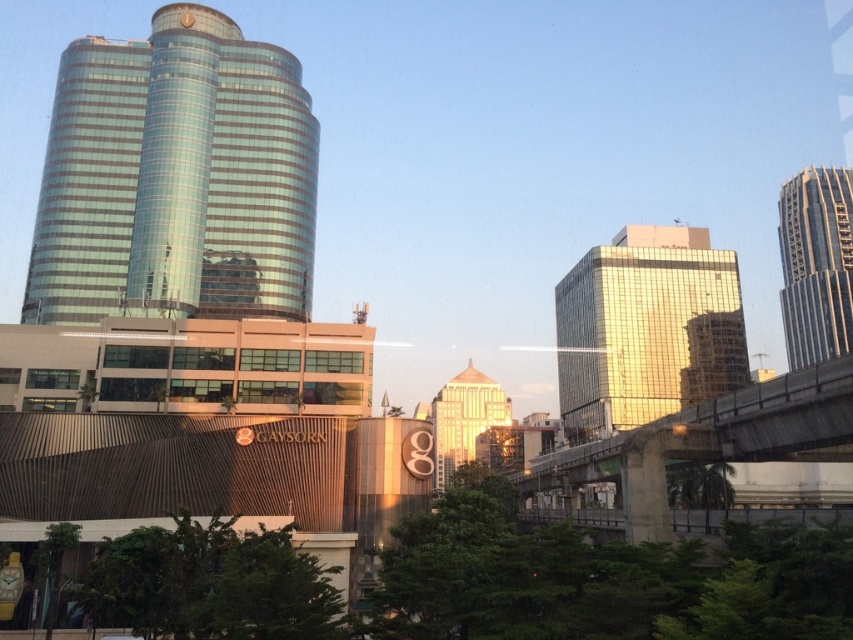
Question: Among these objects, which one is farthest from the camera?

Choices:
 (A) gold glass tower at center
 (B) concrete bridge at right

Answer: (A)

Question: Is concrete bridge at right above glassy metallic skyscraper at right?

Choices:
 (A) no
 (B) yes

Answer: (A)

Question: Does concrete bridge at right appear on the right side of glassy metallic skyscraper at right?

Choices:
 (A) no
 (B) yes

Answer: (A)

Question: Is shiny glass tower at upper left wider than glossy glass building at center?

Choices:
 (A) yes
 (B) no

Answer: (A)

Question: Which point is closer to the camera taking this photo?

Choices:
 (A) (849, 188)
 (B) (471, 380)
 (C) (790, 436)
 (D) (596, 408)

Answer: (C)

Question: Which of these objects is positioned farthest from the glassy metallic skyscraper at right?

Choices:
 (A) concrete bridge at right
 (B) shiny glass tower at upper left
 (C) gold glass tower at center
 (D) glossy glass building at center

Answer: (B)